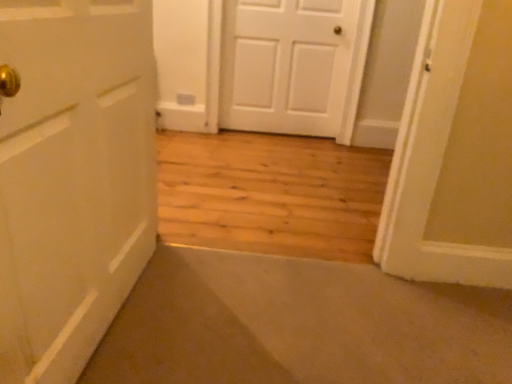
What do you see at coordinates (289, 64) in the screenshot? The image size is (512, 384). I see `white matte door at center` at bounding box center [289, 64].

Locate an element on the screen. The image size is (512, 384). white matte door at center is located at coordinates (289, 64).

Where is `white matte door at center`? The width and height of the screenshot is (512, 384). white matte door at center is located at coordinates (289, 64).